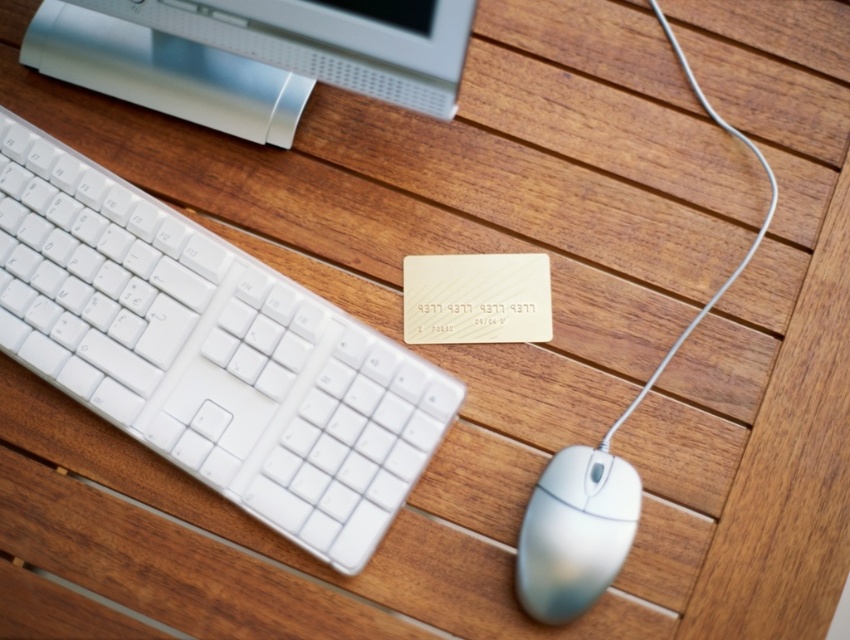
Does satin silver monitor at upper left appear on the right side of white plastic mouse at lower right?

No, satin silver monitor at upper left is not to the right of white plastic mouse at lower right.

Between satin silver monitor at upper left and white plastic mouse at lower right, which one appears on the right side from the viewer's perspective?

Positioned to the right is white plastic mouse at lower right.

Between point (468, 13) and point (630, 509), which one is positioned behind?

The point (630, 509) is more distant.

Where is `satin silver monitor at upper left`? satin silver monitor at upper left is located at coordinates (244, 58).

Who is higher up, white plastic keyboard at upper left or white plastic mouse at lower right?

white plastic keyboard at upper left is higher up.

Who is positioned more to the left, white plastic keyboard at upper left or white plastic mouse at lower right?

white plastic keyboard at upper left is more to the left.

Locate an element on the screen. The image size is (850, 640). white plastic keyboard at upper left is located at coordinates (208, 353).

Who is positioned more to the left, white plastic keyboard at upper left or satin silver monitor at upper left?

white plastic keyboard at upper left is more to the left.

Is white plastic keyboard at upper left to the right of satin silver monitor at upper left from the viewer's perspective?

No, white plastic keyboard at upper left is not to the right of satin silver monitor at upper left.

Is point (136, 356) behind point (445, 81)?

Yes.

At what (x,y) coordinates should I click in order to perform the action: click on white plastic keyboard at upper left. Please return your answer as a coordinate pair (x, y). The height and width of the screenshot is (640, 850). Looking at the image, I should click on (208, 353).